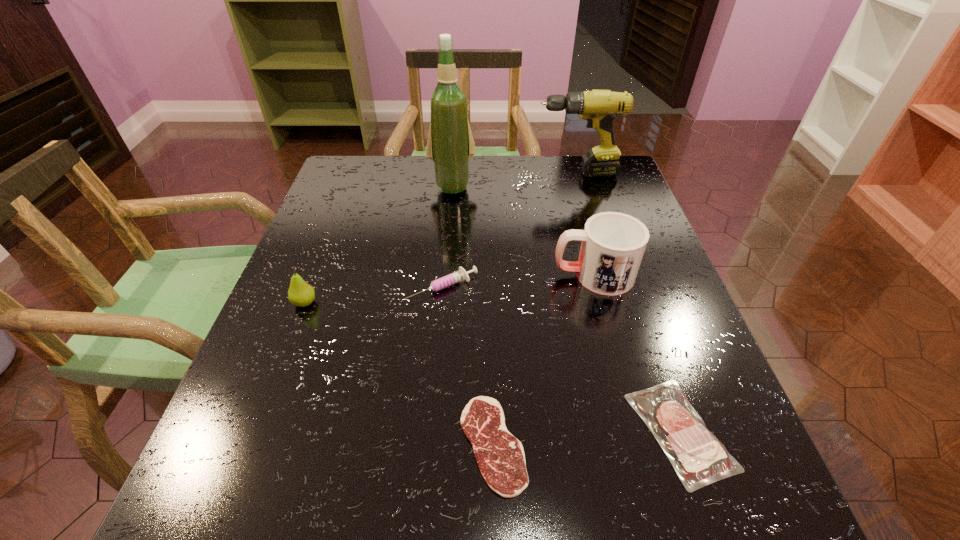
You are a GUI agent. You are given a task and a screenshot of the screen. Output one action in this format:
    pyautogui.click(x=<x>, y=<y>)
    Task: Click on the free space located 0.140m on the front-facing side of the tallest object
    
    Given the screenshot: What is the action you would take?
    pyautogui.click(x=448, y=233)

Identify the location of free spot located 0.250m on the handle side of the drill. This screenshot has height=540, width=960. (444, 173).

Find the location of `vacant area situated 0.130m on the handle side of the drill`. vacant area situated 0.130m on the handle side of the drill is located at coordinates (488, 173).

Image resolution: width=960 pixels, height=540 pixels. I want to click on vacant space located on the handle side of the drill, so click(x=444, y=173).

At what (x,y) coordinates should I click in order to perform the action: click on blank space located on the side of the third tallest object with the handle. Please return your answer as a coordinate pair (x, y). Looking at the image, I should click on (472, 275).

You are a GUI agent. You are given a task and a screenshot of the screen. Output one action in this format:
    pyautogui.click(x=<x>, y=<y>)
    Task: Click on the free spot located 0.280m on the side of the third tallest object with the handle
    
    Given the screenshot: What is the action you would take?
    pyautogui.click(x=420, y=275)

Where is `vacant area situated on the side of the third tallest object with the handle`? vacant area situated on the side of the third tallest object with the handle is located at coordinates (496, 275).

Find the location of a particular element. This screenshot has height=540, width=960. vacant region located 0.280m on the back of the leftmost object is located at coordinates (340, 213).

The height and width of the screenshot is (540, 960). What are the coordinates of `blank space located 0.250m on the right of the syringe` in the screenshot? It's located at (599, 287).

In order to click on free space located 0.360m on the back of the taller steak in this screenshot , I will do `click(615, 244)`.